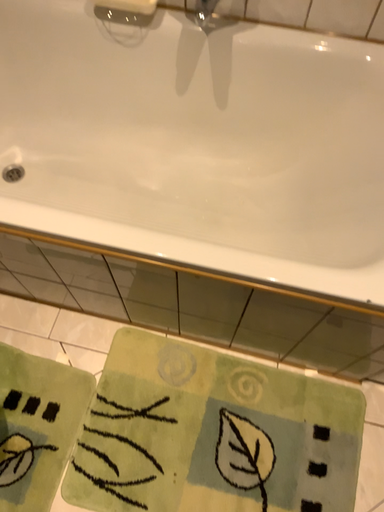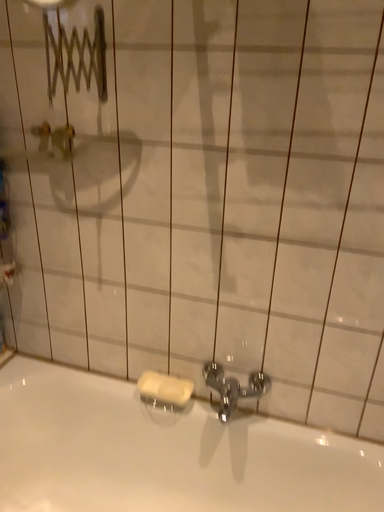
Question: Which way did the camera rotate in the video?

Choices:
 (A) rotated downward
 (B) rotated upward

Answer: (B)